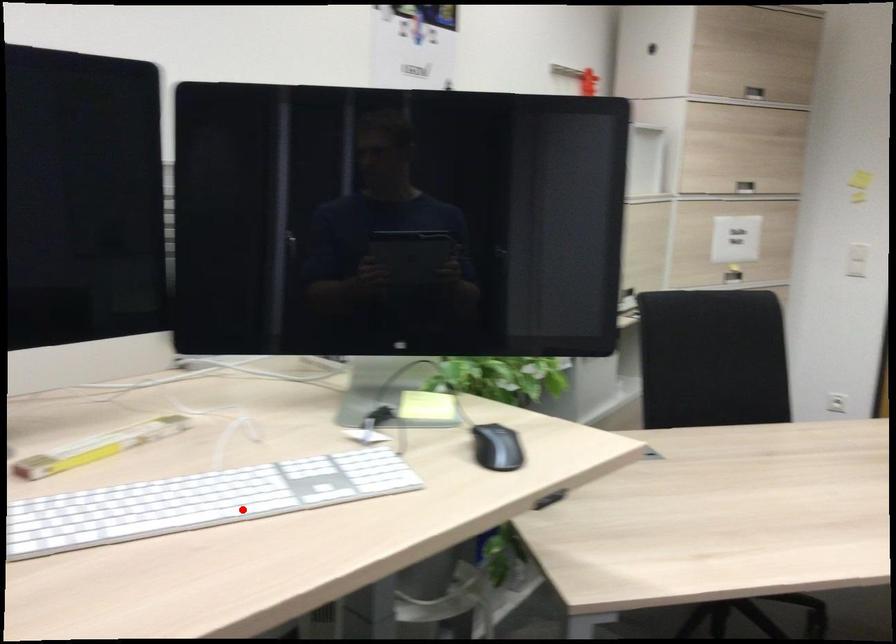
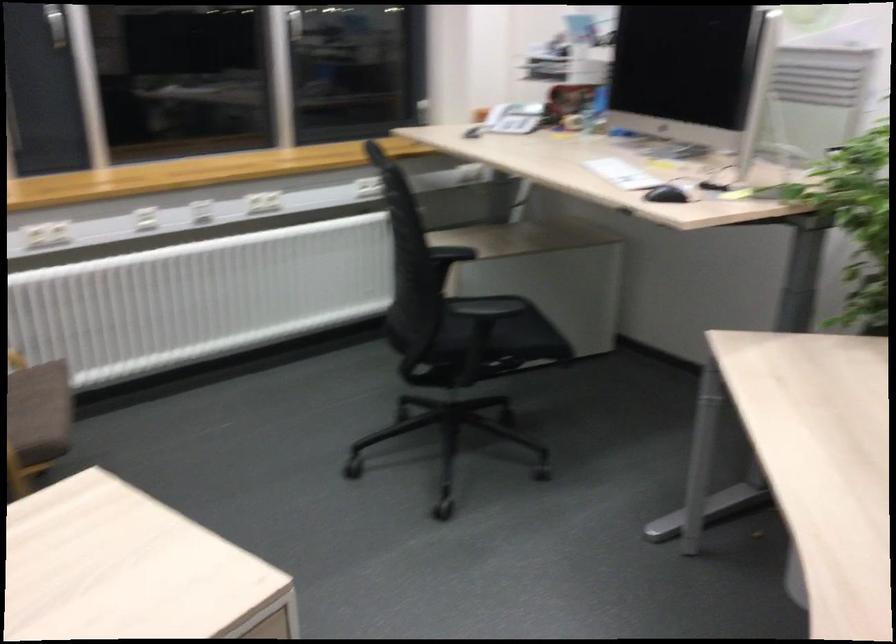
Where in the second image is the point corresponding to the highlighted location from the first image?

(622, 174)